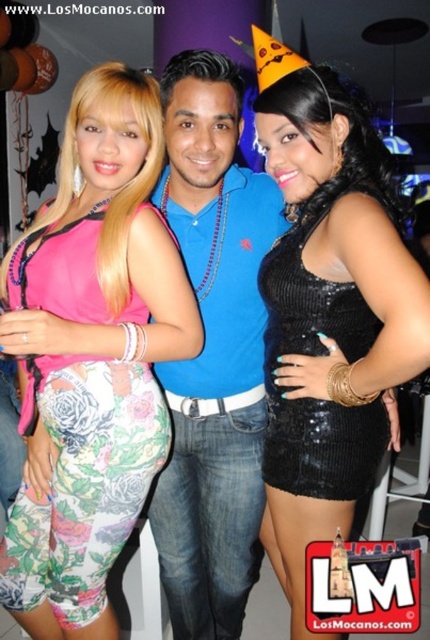
Question: Among these points, which one is nearest to the camera?

Choices:
 (A) (21, 497)
 (B) (237, 237)

Answer: (A)

Question: Is black sequined dress at center smaller than black sequined dress at right?

Choices:
 (A) no
 (B) yes

Answer: (A)

Question: In this image, where is blue denim jeans at center located relative to black sequined dress at right?

Choices:
 (A) right
 (B) left

Answer: (B)

Question: Does floral leggings at center have a lesser width compared to black sequined dress at right?

Choices:
 (A) no
 (B) yes

Answer: (A)

Question: Which point is farther to the camera?

Choices:
 (A) (86, 566)
 (B) (282, 314)

Answer: (B)

Question: Considering the real-world distances, which object is closest to the floral leggings at center?

Choices:
 (A) black sequined dress at center
 (B) black sequined dress at right

Answer: (B)